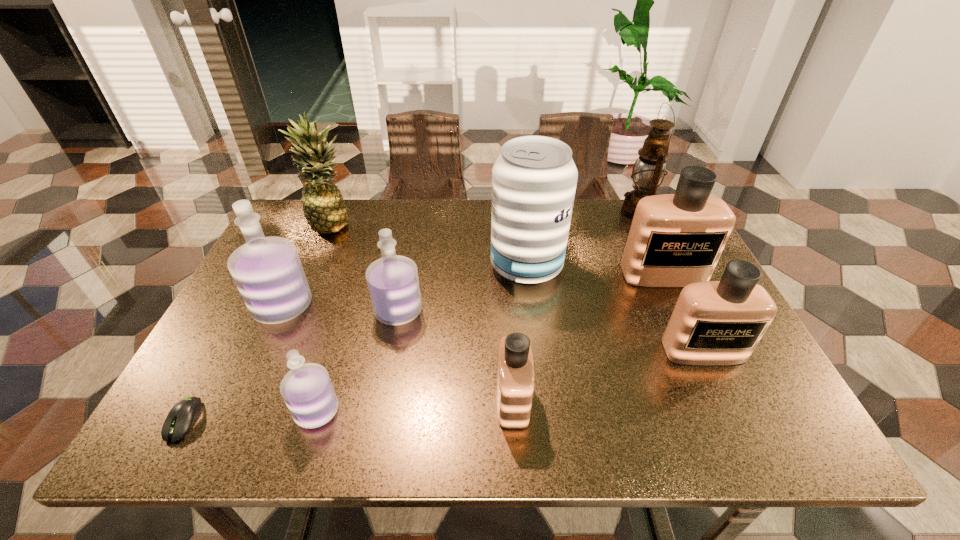
Find the location of a particular element. The image size is (960, 540). free space located on the front label of the farthest beige perfume is located at coordinates (730, 417).

The image size is (960, 540). I want to click on vacant space positioned 0.340m on the right of the rightmost purple perfume, so click(x=561, y=310).

Locate an element on the screen. free region located on the front label of the fourth nearest object is located at coordinates (726, 399).

Locate an element on the screen. The width and height of the screenshot is (960, 540). free space located 0.380m on the front label of the smallest beige perfume is located at coordinates (309, 400).

Identify the location of vacant space situated on the front label of the smallest beige perfume. The width and height of the screenshot is (960, 540). (314, 400).

Locate an element on the screen. Image resolution: width=960 pixels, height=540 pixels. free space located on the front label of the smallest beige perfume is located at coordinates (462, 400).

You are a GUI agent. You are given a task and a screenshot of the screen. Output one action in this format:
    pyautogui.click(x=<x>, y=<y>)
    Task: Click on the vacant position located on the right of the nearest purple perfume
    
    Given the screenshot: What is the action you would take?
    pyautogui.click(x=520, y=410)

Where is `oil lamp situated at the far edge`? This screenshot has width=960, height=540. oil lamp situated at the far edge is located at coordinates (648, 172).

At what (x,y) coordinates should I click in order to perform the action: click on pineapple located at the far edge. Please return your answer as a coordinate pair (x, y). This screenshot has width=960, height=540. Looking at the image, I should click on (324, 208).

The image size is (960, 540). I want to click on alcohol that is at the far edge, so click(534, 179).